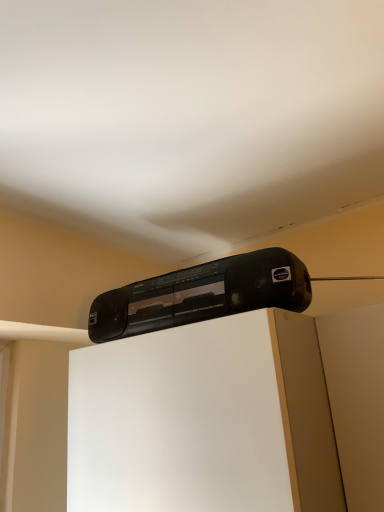
Image resolution: width=384 pixels, height=512 pixels. I want to click on black plastic stereo at upper center, so click(202, 294).

Describe the element at coordinates (202, 294) in the screenshot. The height and width of the screenshot is (512, 384). I see `black plastic stereo at upper center` at that location.

At what (x,y) coordinates should I click in order to perform the action: click on black plastic stereo at upper center. Please return your answer as a coordinate pair (x, y). The image size is (384, 512). Looking at the image, I should click on [202, 294].